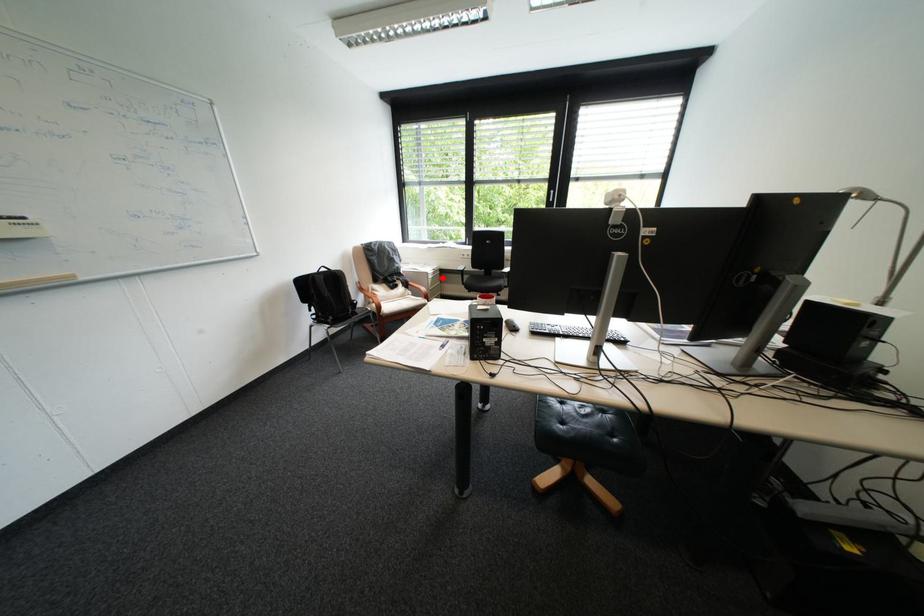
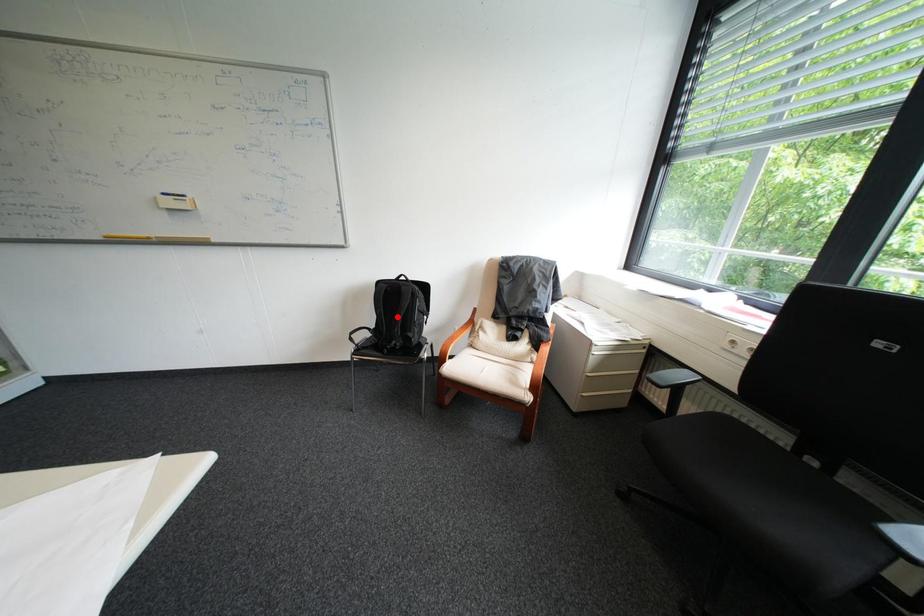
I am providing you with two images of the same scene from different viewpoints. A red point is marked on the first image and another point is marked on the second image. Is the marked point in image1 the same physical position as the marked point in image2?

No